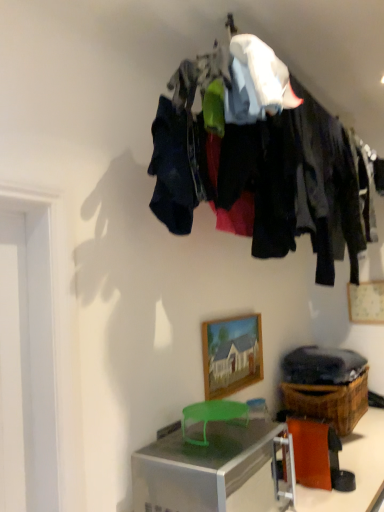
Question: Considering the positions of wooden picture frame at upper right, which appears as the 2th picture frame when viewed from the left, and brown woven basket at lower right in the image, is wooden picture frame at upper right, which appears as the 2th picture frame when viewed from the left, taller or shorter than brown woven basket at lower right?

Choices:
 (A) tall
 (B) short

Answer: (B)

Question: From a real-world perspective, is wooden picture frame at upper right, marked as the first picture frame in a right-to-left arrangement, physically located above or below brown woven basket at lower right?

Choices:
 (A) above
 (B) below

Answer: (A)

Question: Based on their relative distances, which object is nearer to the orange paper at lower right?

Choices:
 (A) wooden picture frame at center, marked as the second picture frame in a right-to-left arrangement
 (B) dark fabric clothes at upper center
 (C) silver metallic desk at lower center
 (D) brown woven basket at lower right
 (E) wooden picture frame at upper right, which is counted as the first picture frame, starting from the back

Answer: (C)

Question: Estimate the real-world distances between objects in this image. Which object is closer to the wooden picture frame at upper right, marked as the first picture frame in a right-to-left arrangement?

Choices:
 (A) orange paper at lower right
 (B) dark fabric clothes at upper center
 (C) wooden picture frame at center, the 2th picture frame when ordered from back to front
 (D) brown woven basket at lower right
 (E) silver metallic desk at lower center

Answer: (D)